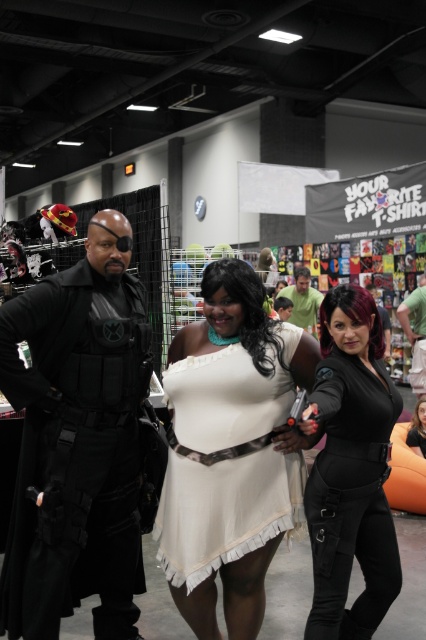
Is point (371, 424) positioned behind point (287, 304)?

No, (371, 424) is closer to viewer.

In order to click on matte black bodysuit at center in this screenshot , I will do `click(351, 468)`.

Does black matte vest at center have a greater width compared to black leather vest at center?

Indeed, black matte vest at center has a greater width compared to black leather vest at center.

The height and width of the screenshot is (640, 426). In order to click on black matte vest at center in this screenshot , I will do `click(77, 440)`.

This screenshot has height=640, width=426. I want to click on matte black bodysuit at center, so click(351, 468).

Is matte black bodysuit at center wider than black leather vest at center?

No.

This screenshot has height=640, width=426. Describe the element at coordinates (351, 468) in the screenshot. I see `matte black bodysuit at center` at that location.

Where is `matte black bodysuit at center`? The width and height of the screenshot is (426, 640). matte black bodysuit at center is located at coordinates (351, 468).